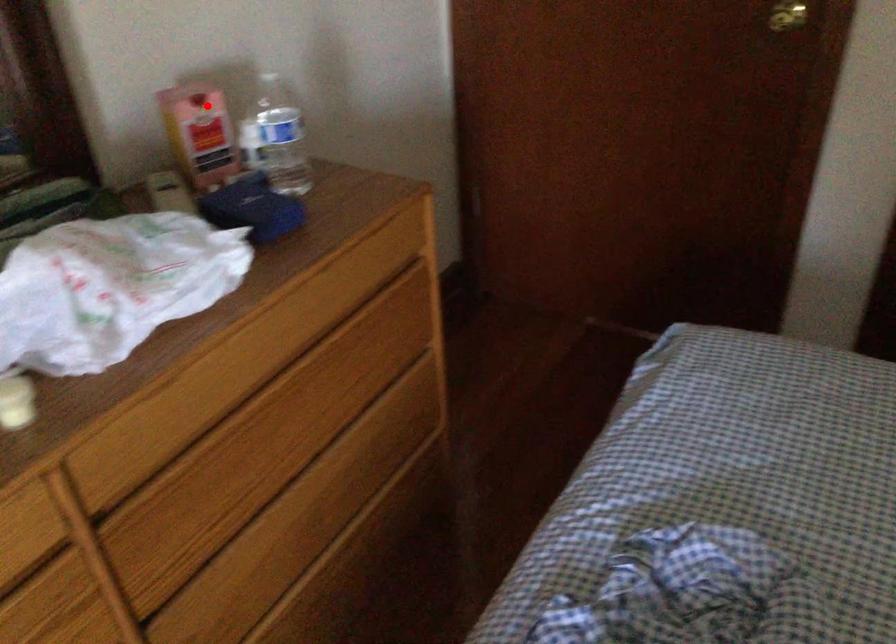
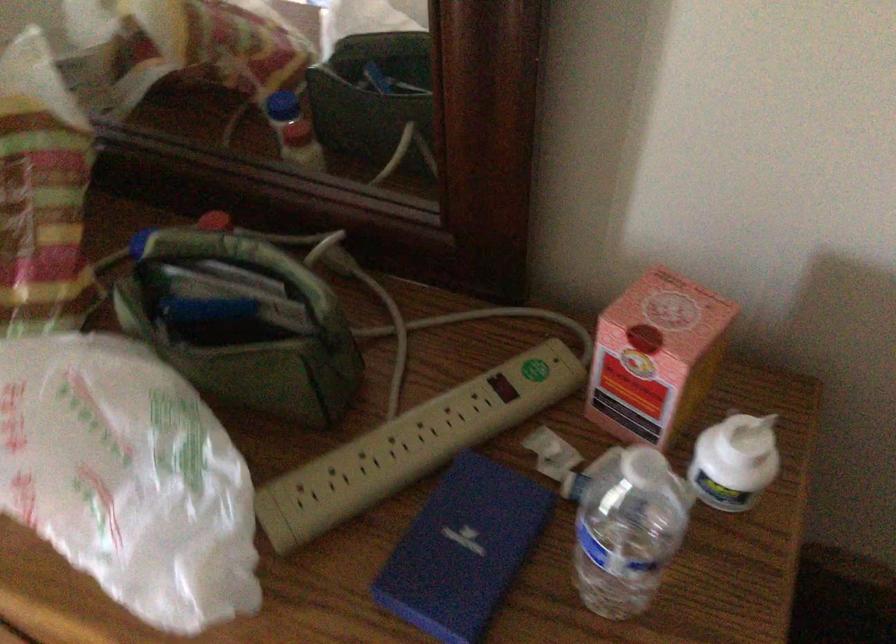
Locate, in the second image, the point that corresponds to the highlighted location in the first image.

(656, 357)